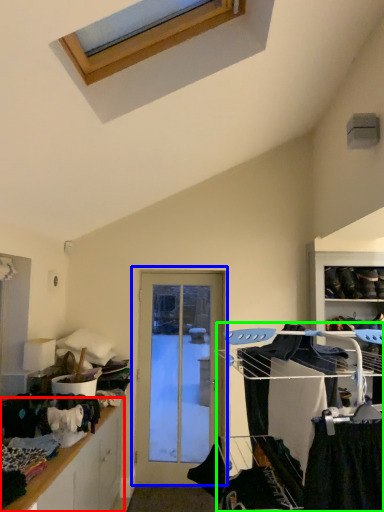
Question: Based on their relative distances, which object is farther from cabinetry (highlighted by a red box)? Choose from door (highlighted by a blue box) and bunk bed (highlighted by a green box).

Choices:
 (A) door
 (B) bunk bed

Answer: (B)